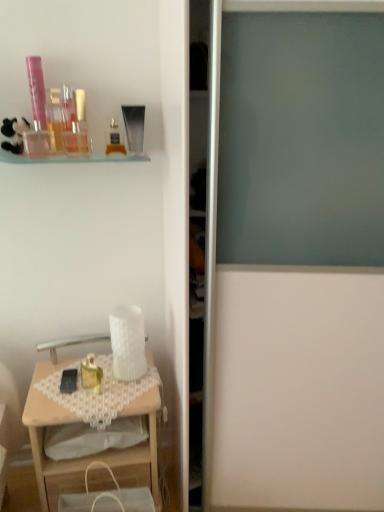
Locate an element on the screen. The height and width of the screenshot is (512, 384). free location in front of black matte mobile phone at lower left is located at coordinates (62, 401).